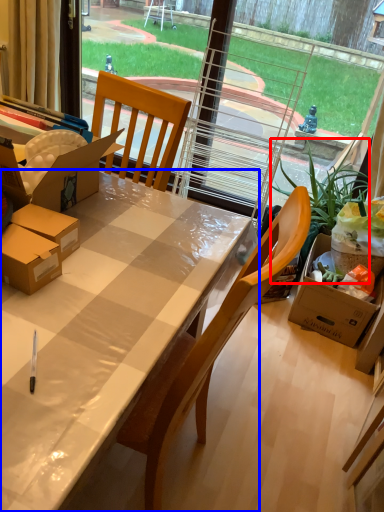
Question: Which of the following is the closest to the observer, houseplant (highlighted by a red box) or desk (highlighted by a blue box)?

Choices:
 (A) houseplant
 (B) desk

Answer: (B)